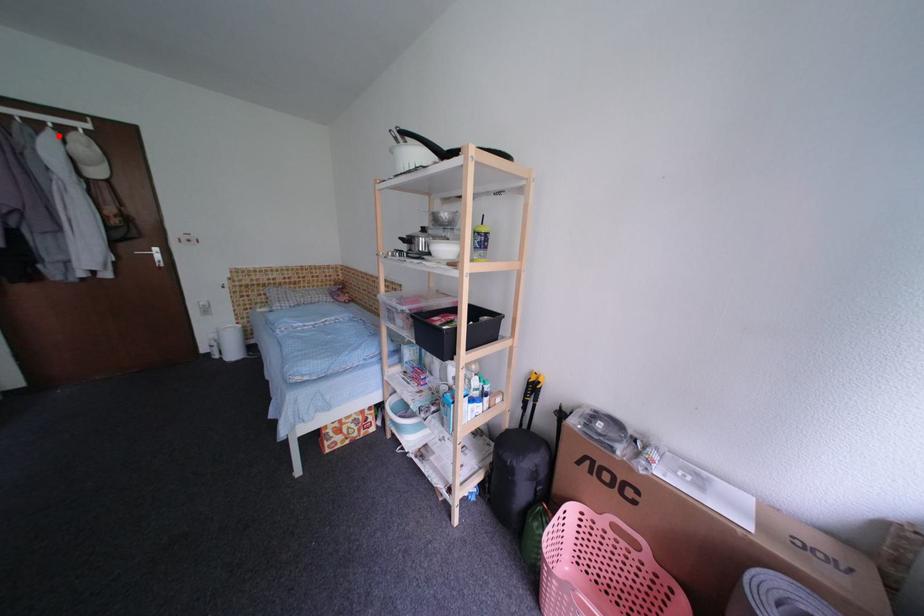
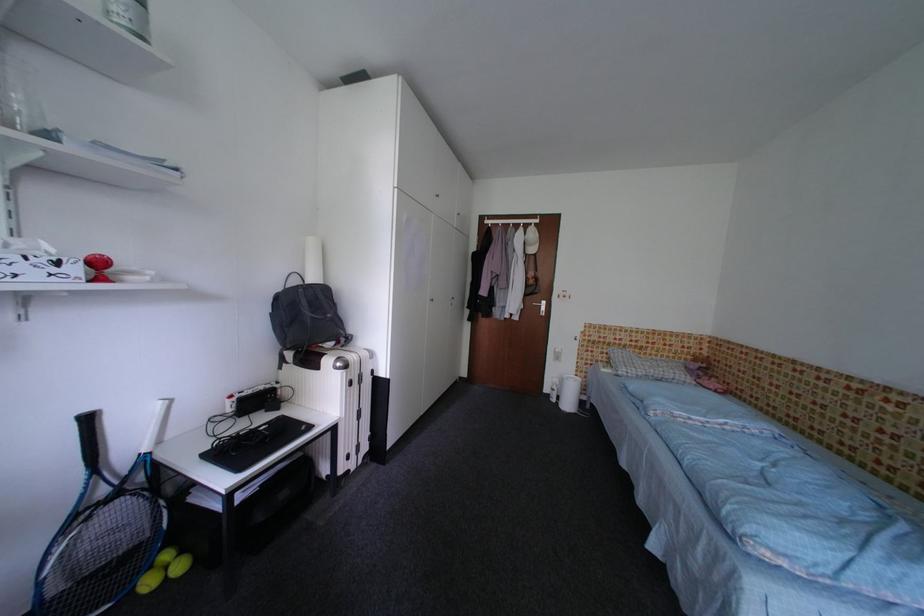
Question: A red point is marked in image1. In image2, is the corresponding 3D point closer to the camera or farther? Reply with the corresponding letter.

Choices:
 (A) The corresponding 3D point is closer.
 (B) The corresponding 3D point is farther.

Answer: (A)